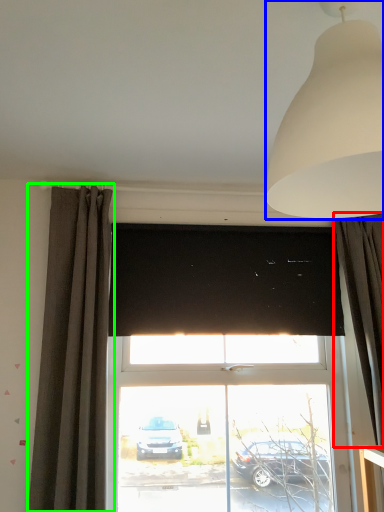
Question: Which is farther away from curtain (highlighted by a red box)? lamp (highlighted by a blue box) or curtain (highlighted by a green box)?

Choices:
 (A) lamp
 (B) curtain

Answer: (B)